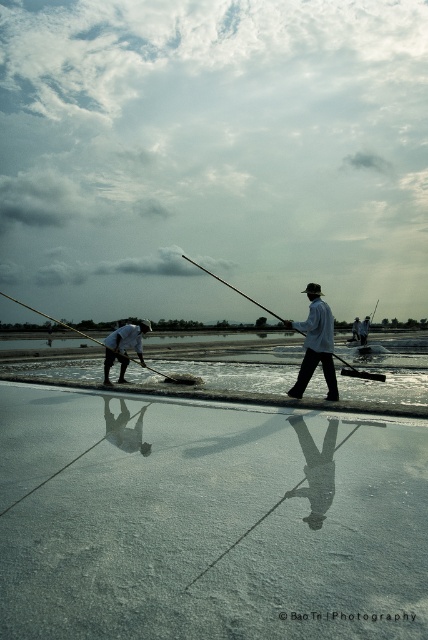
Question: Does light blue fabric fisherman at center appear over wooden pole at left?

Choices:
 (A) no
 (B) yes

Answer: (A)

Question: Which point appears farthest from the camera in this image?

Choices:
 (A) (321, 300)
 (B) (273, 314)
 (C) (109, 333)
 (D) (26, 305)

Answer: (D)

Question: Is light blue fabric fisherman at center bigger than white matte fisherman at lower left?

Choices:
 (A) no
 (B) yes

Answer: (B)

Question: Which object is closer to the camera taking this photo?

Choices:
 (A) wooden fishing pole at center
 (B) wooden pole at left
 (C) light blue fabric fisherman at center
 (D) white matte fisherman at lower left

Answer: (C)

Question: Which object is the closest to the light blue fabric fisherman at center?

Choices:
 (A) wooden pole at left
 (B) white matte fisherman at lower left
 (C) wooden fishing pole at center

Answer: (C)

Question: Can you confirm if white matte fisherman at lower left is bigger than wooden pole at left?

Choices:
 (A) yes
 (B) no

Answer: (B)